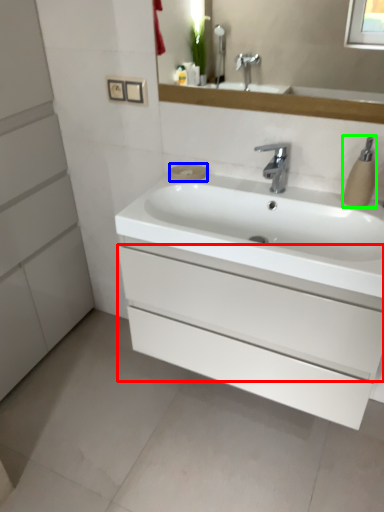
Question: Based on their relative distances, which object is farther from drawer (highlighted by a red box)? Choose from soap (highlighted by a blue box) and soap dispenser (highlighted by a green box).

Choices:
 (A) soap
 (B) soap dispenser

Answer: (A)